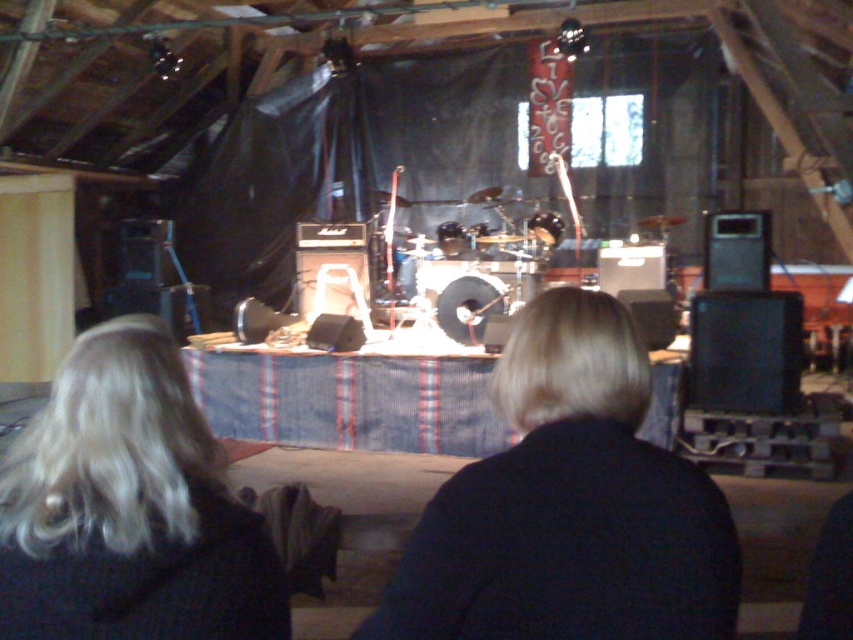
Who is taller, blonde hair at center or blonde hair at lower left?

Standing taller between the two is blonde hair at center.

Is the position of blonde hair at center more distant than that of blonde hair at lower left?

No, blonde hair at center is in front of blonde hair at lower left.

Is point (631, 461) closer to camera compared to point (177, 442)?

That is True.

You are a GUI agent. You are given a task and a screenshot of the screen. Output one action in this format:
    pyautogui.click(x=<x>, y=<y>)
    Task: Click on the blonde hair at center
    The width and height of the screenshot is (853, 640).
    Given the screenshot: What is the action you would take?
    (567, 506)